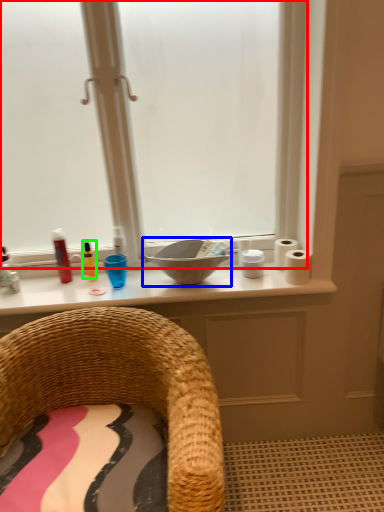
Question: Based on their relative distances, which object is nearer to window (highlighted by a red box)? Choose from sink (highlighted by a blue box) and toiletry (highlighted by a green box).

Choices:
 (A) sink
 (B) toiletry

Answer: (B)